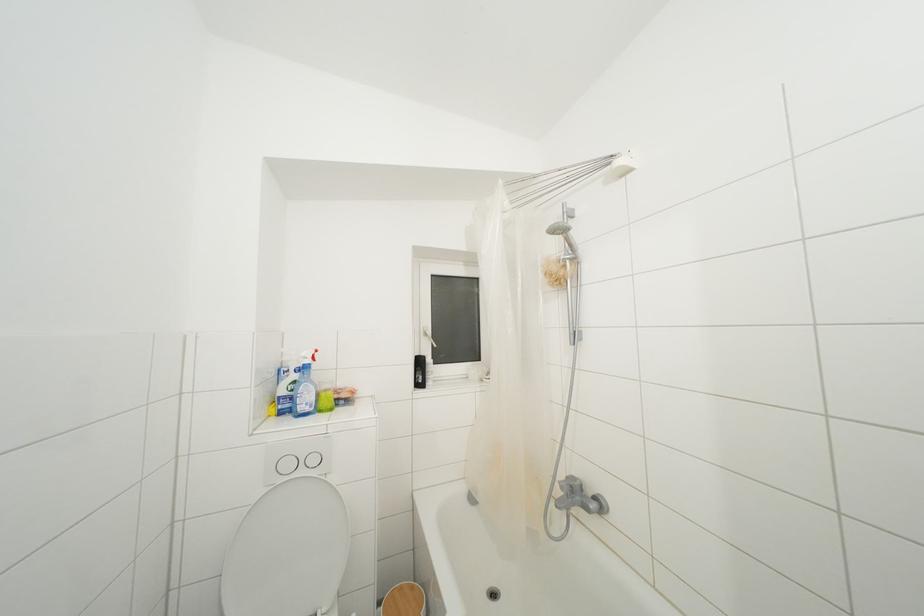
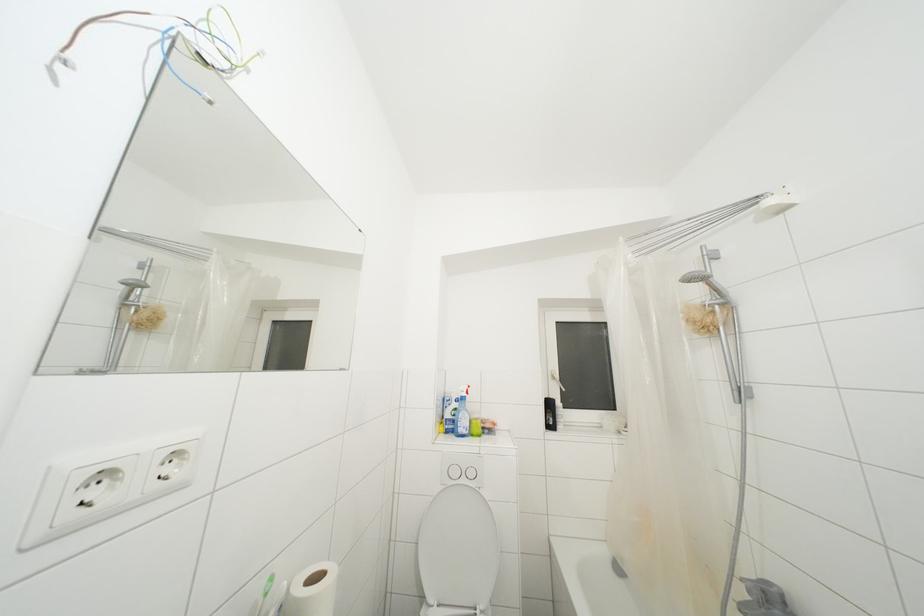
Question: The images are taken continuously from a first-person perspective. In which direction is your viewpoint rotating?

Choices:
 (A) Left
 (B) Right
 (C) Up
 (D) Down

Answer: (A)